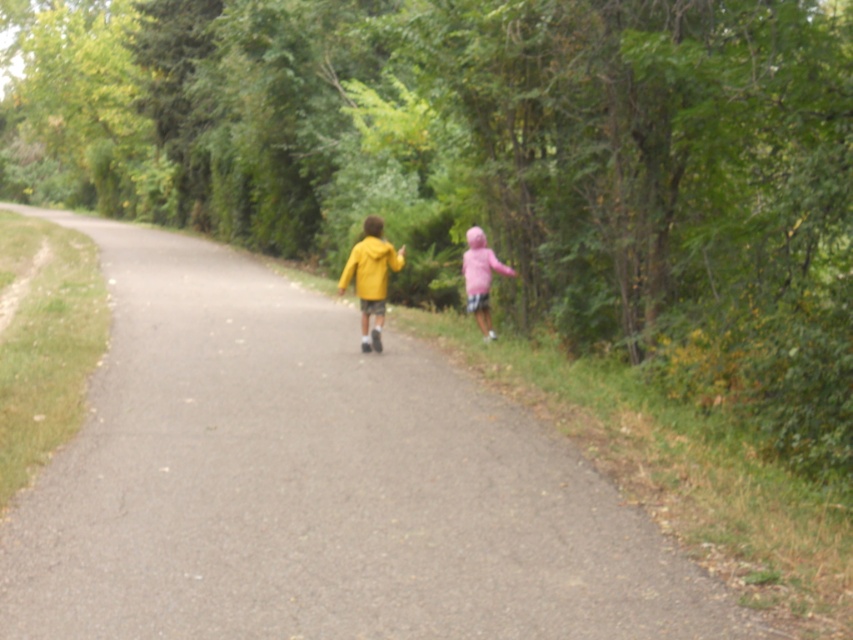
Who is more distant from viewer, [657,529] or [347,276]?

The point [347,276] is behind.

The height and width of the screenshot is (640, 853). What do you see at coordinates (317, 484) in the screenshot? I see `asphalt road at center` at bounding box center [317, 484].

In order to click on asphalt road at center in this screenshot , I will do `click(317, 484)`.

Which of these two, asphalt road at center or pink fleece jacket at right, stands shorter?

pink fleece jacket at right is shorter.

Who is taller, asphalt road at center or pink fleece jacket at right?

asphalt road at center

Is point (143, 508) positioned behind point (467, 284)?

No, it is in front of (467, 284).

Find the location of `asphalt road at center`. asphalt road at center is located at coordinates (317, 484).

Is matte yellow jacket at center above pink fleece jacket at right?

No, matte yellow jacket at center is not above pink fleece jacket at right.

Can you confirm if matte yellow jacket at center is thinner than pink fleece jacket at right?

In fact, matte yellow jacket at center might be wider than pink fleece jacket at right.

Between point (358, 296) and point (482, 326), which one is positioned behind?

Positioned behind is point (482, 326).

Image resolution: width=853 pixels, height=640 pixels. In order to click on matte yellow jacket at center in this screenshot , I will do `click(370, 276)`.